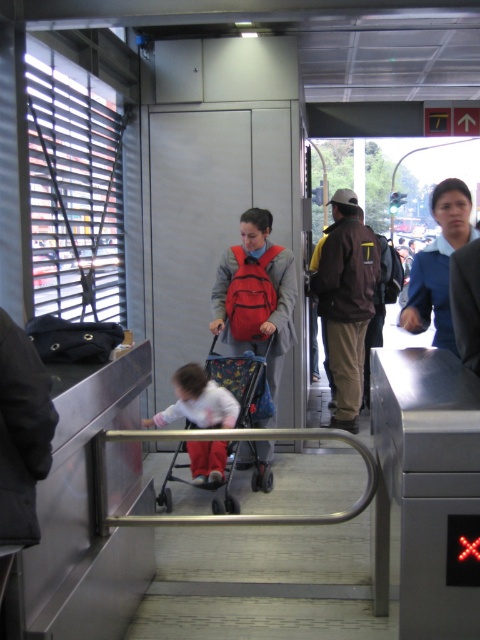
Which of these two, brown leather jacket at center or multicolored fabric baby carriage at center, stands taller?

brown leather jacket at center is taller.

You are a GUI agent. You are given a task and a screenshot of the screen. Output one action in this format:
    pyautogui.click(x=<x>, y=<y>)
    Task: Click on the brown leather jacket at center
    
    Given the screenshot: What is the action you would take?
    pyautogui.click(x=346, y=301)

Find the location of a particular element. This screenshot has height=640, width=480. brown leather jacket at center is located at coordinates (346, 301).

Is matte red backpack at center thinner than brown leather jacket at center?

Yes.

Can you confirm if matte red backpack at center is positioned above brown leather jacket at center?

No.

Find the location of a particular element. The image size is (480, 640). matte red backpack at center is located at coordinates tap(255, 294).

Based on the photo, does multicolored fabric baby carriage at center have a smaller size compared to white cotton shirt at center?

Incorrect, multicolored fabric baby carriage at center is not smaller in size than white cotton shirt at center.

Is multicolored fabric baby carriage at center to the left of white cotton shirt at center from the viewer's perspective?

In fact, multicolored fabric baby carriage at center is to the right of white cotton shirt at center.

Is point (222, 369) closer to camera compared to point (216, 467)?

No, (222, 369) is further to viewer.

Where is `multicolored fabric baby carriage at center`? Image resolution: width=480 pixels, height=640 pixels. multicolored fabric baby carriage at center is located at coordinates click(220, 394).